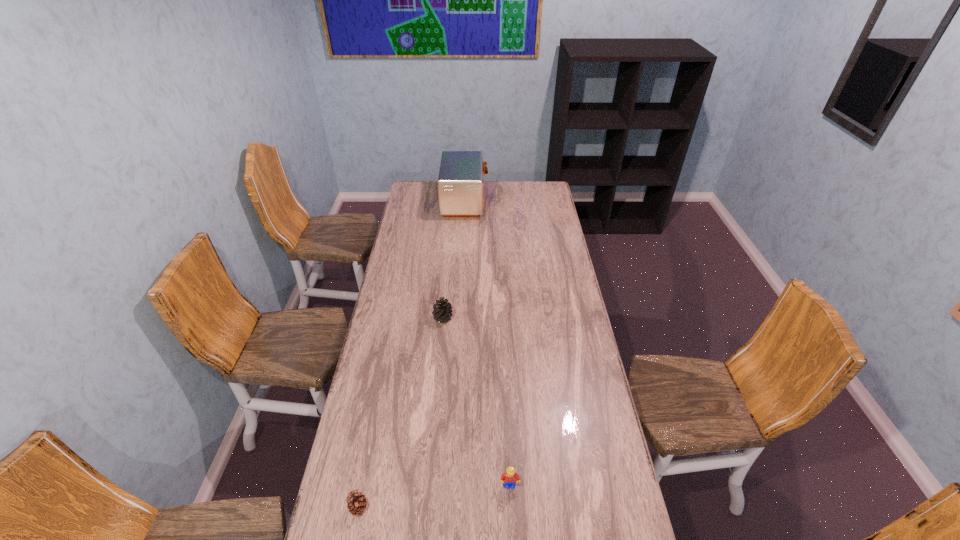
Image resolution: width=960 pixels, height=540 pixels. I want to click on the farthest object, so click(x=460, y=182).

Locate an element on the screen. the tallest object is located at coordinates point(460,182).

At what (x,y) coordinates should I click in order to perform the action: click on the second farthest object. Please return your answer as a coordinate pair (x, y). This screenshot has width=960, height=540. Looking at the image, I should click on (442, 312).

Find the location of a particular element. The width and height of the screenshot is (960, 540). the taller pinecone is located at coordinates (442, 312).

I want to click on the rightmost object, so click(510, 477).

Where is `Lego`? Image resolution: width=960 pixels, height=540 pixels. Lego is located at coordinates (510, 477).

Find the location of a particular element. the left pinecone is located at coordinates (356, 503).

Locate an element on the screen. Image resolution: width=960 pixels, height=540 pixels. the shorter pinecone is located at coordinates (356, 503).

Where is `free space located on the door side of the farthest object`? The width and height of the screenshot is (960, 540). free space located on the door side of the farthest object is located at coordinates coord(534,201).

Identify the location of free space located 0.110m on the front of the second farthest object. (441, 346).